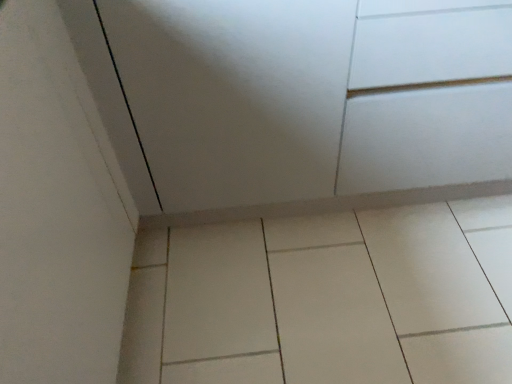
What is the approximate height of white matte tile at center?

white matte tile at center is 2.95 inches in height.

You are a GUI agent. You are given a task and a screenshot of the screen. Output one action in this format:
    pyautogui.click(x=<x>, y=<y>)
    Task: Click on the white matte tile at center
    The width and height of the screenshot is (512, 384).
    Given the screenshot: What is the action you would take?
    pyautogui.click(x=326, y=299)

This screenshot has height=384, width=512. What do you see at coordinates (326, 299) in the screenshot?
I see `white matte tile at center` at bounding box center [326, 299].

You are a GUI agent. You are given a task and a screenshot of the screen. Output one action in this format:
    pyautogui.click(x=<x>, y=<y>)
    Task: Click on the white matte tile at center
    This screenshot has width=512, height=384.
    Given the screenshot: What is the action you would take?
    pyautogui.click(x=326, y=299)